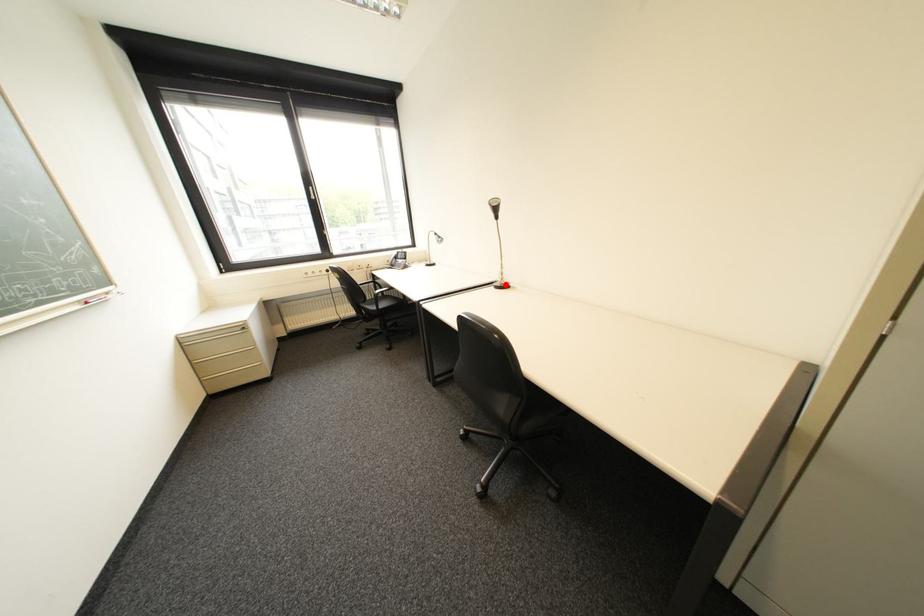
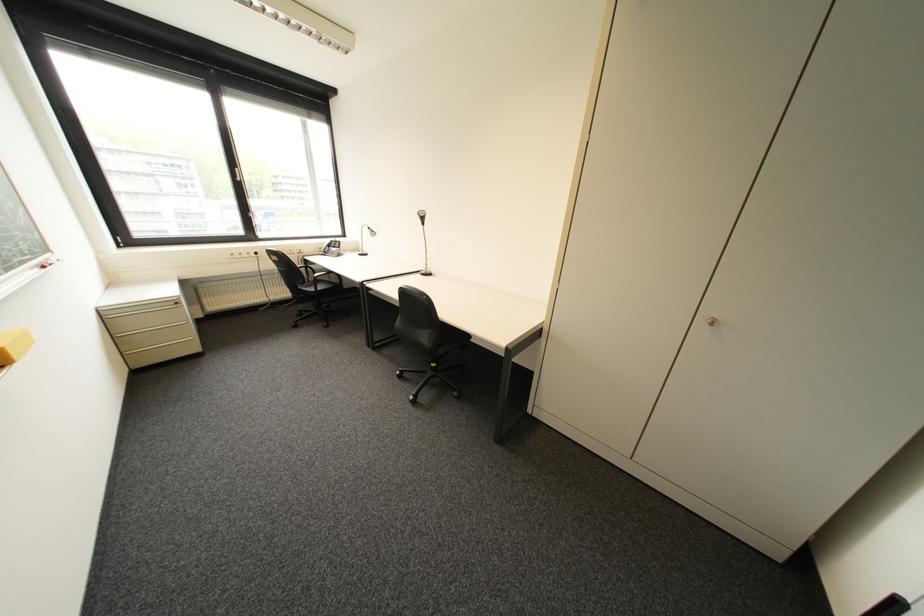
Where in the second image is the point corresponding to the highlighted location from the first image?

(432, 273)